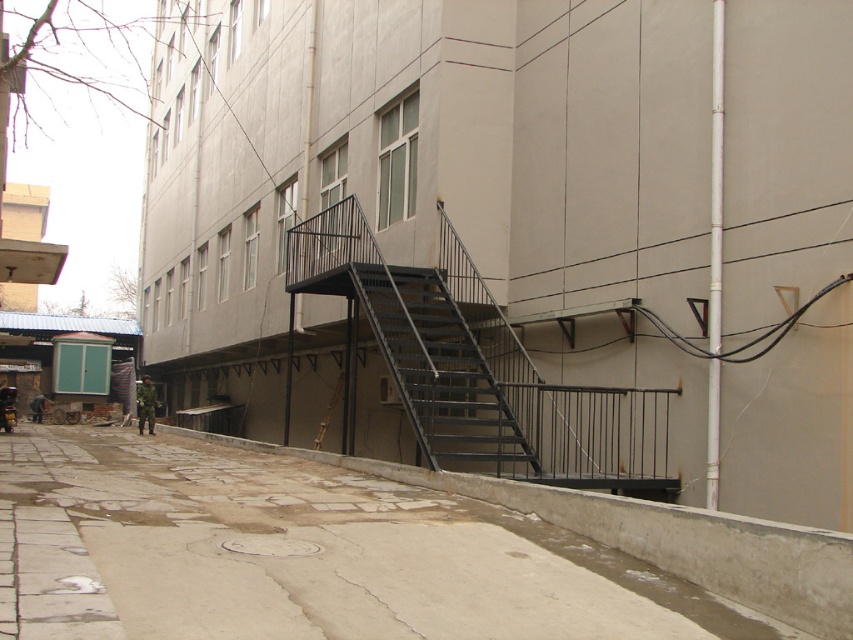
How much distance is there between metallic black staircase at center and black metal stairwell at center?

metallic black staircase at center and black metal stairwell at center are 3.76 meters apart from each other.

Is metallic black staircase at center to the left of black metal stairwell at center from the viewer's perspective?

Indeed, metallic black staircase at center is positioned on the left side of black metal stairwell at center.

Between point (544, 388) and point (415, 356), which one is positioned behind?

Positioned behind is point (415, 356).

Identify the location of metallic black staircase at center. (473, 368).

From the picture: Does gray concrete alley at lower center have a lesser height compared to metallic black staircase at center?

No.

Is gray concrete alley at lower center below metallic black staircase at center?

Correct, gray concrete alley at lower center is located below metallic black staircase at center.

Find the location of `gray concrete alley at lower center`. gray concrete alley at lower center is located at coordinates (302, 554).

Can you confirm if gray concrete alley at lower center is positioned below black metal stairwell at center?

Yes.

Which is below, gray concrete alley at lower center or black metal stairwell at center?

gray concrete alley at lower center

Which is behind, point (218, 577) or point (532, 468)?

Point (532, 468)

This screenshot has height=640, width=853. I want to click on gray concrete alley at lower center, so pos(302,554).